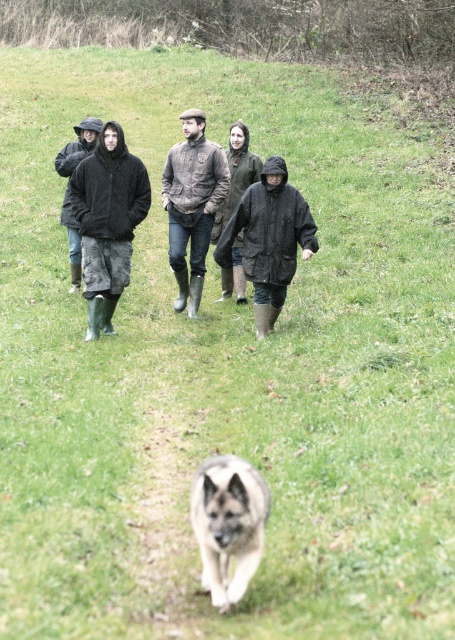
Question: Which point appears farthest from the camera in this image?

Choices:
 (A) (242, 166)
 (B) (293, 220)
 (C) (121, 214)

Answer: (A)

Question: Does matte black jacket at center have a smaller size compared to leather jacket at center?

Choices:
 (A) no
 (B) yes

Answer: (A)

Question: Which object appears farthest from the camera in this image?

Choices:
 (A) leather jacket at center
 (B) matte black jacket at center
 (C) gray-furred dog at center

Answer: (A)

Question: Considering the relative positions of matte black jacket at center and leather jacket at center in the image provided, where is matte black jacket at center located with respect to leather jacket at center?

Choices:
 (A) left
 (B) right

Answer: (A)

Question: Can you confirm if dark matte jacket at center is positioned to the left of dark brown leather jacket at center?

Choices:
 (A) no
 (B) yes

Answer: (A)

Question: Which point is farther to the camera?

Choices:
 (A) camouflage jacket at left
 (B) gray-furred dog at center

Answer: (A)